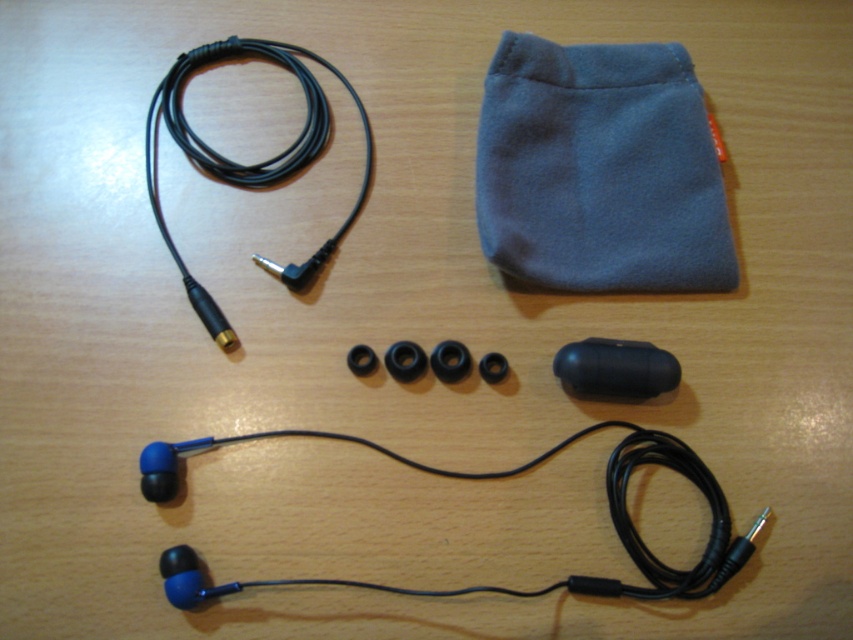
Is blue fleece pouch at upper right in front of black cable at upper left?

No, it is behind black cable at upper left.

Can you confirm if blue fleece pouch at upper right is smaller than black cable at upper left?

Yes.

Which is in front, point (642, 156) or point (270, 173)?

Point (270, 173) is in front.

Locate an element on the screen. The image size is (853, 640). blue fleece pouch at upper right is located at coordinates (599, 170).

Between point (706, 595) and point (242, 164), which one is positioned in front?

Point (706, 595)

Does point (317, 579) come farther from viewer compared to point (206, 308)?

No.

Is point (723, 532) positioned in front of point (192, 65)?

Yes, point (723, 532) is in front of point (192, 65).

What are the coordinates of `blue matte earphones at bottom` in the screenshot? It's located at (498, 477).

Between blue fleece pouch at upper right and blue matte earphones at bottom, which one has less height?

blue matte earphones at bottom is shorter.

Is point (653, 76) farther from camera compared to point (390, 451)?

Yes, it is.

Identify the location of blue fleece pouch at upper right. The height and width of the screenshot is (640, 853). [x=599, y=170].